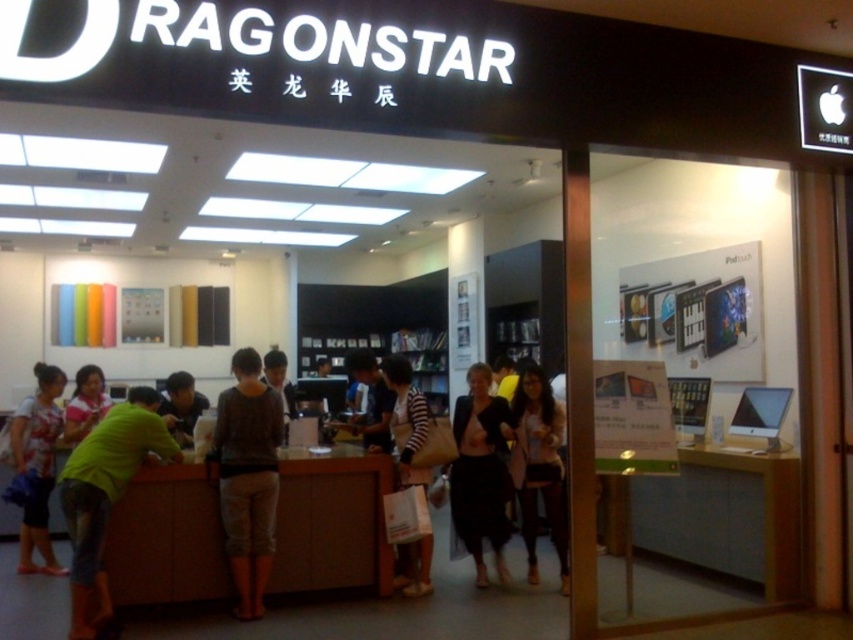
You are a customer in the store and want to see the items on the counter. There is a black sheer skirt at center and a light brown leather jacket at center blocking your view. Which item is taller and blocking your view more?

The black sheer skirt at center is much taller as light brown leather jacket at center, so it is blocking your view more.

You are a customer in the Dragonstar store and want to find the staff member wearing the green matte shirt at left. According to the store layout, where should you look to find them?

The green matte shirt at left is located at point (105,496), so you should look towards the left side of the store near the entrance area.

You are a customer in the store and want to pick up both the black sheer skirt at center and the light brown leather jacket at center. Which item is closer to you?

The black sheer skirt at center is closer to you because it is further to the viewer than the light brown leather jacket at center.